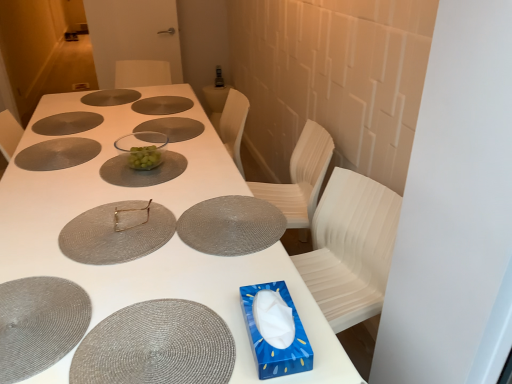
This screenshot has height=384, width=512. Find the location of `vacant area to the right of transparent glass bowl at center`. vacant area to the right of transparent glass bowl at center is located at coordinates (175, 158).